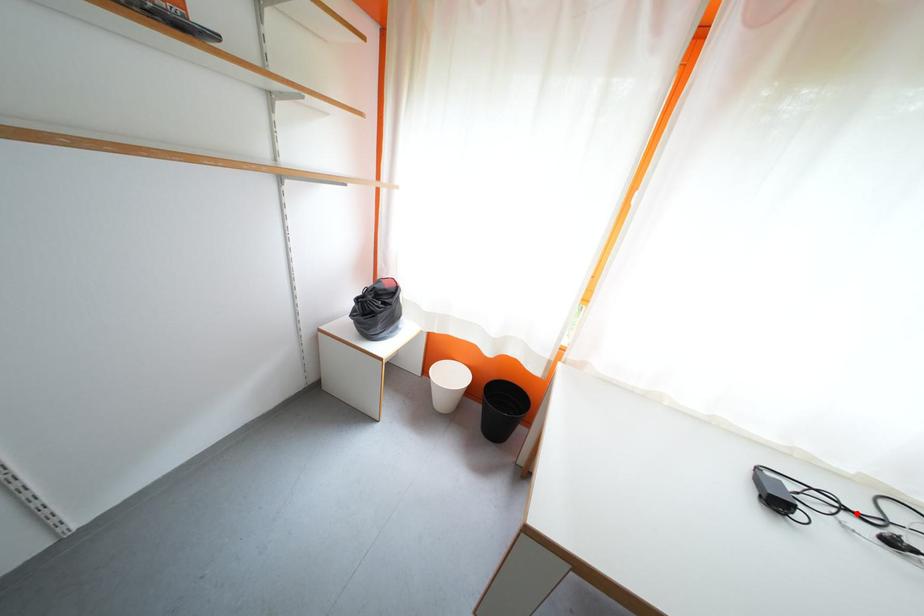
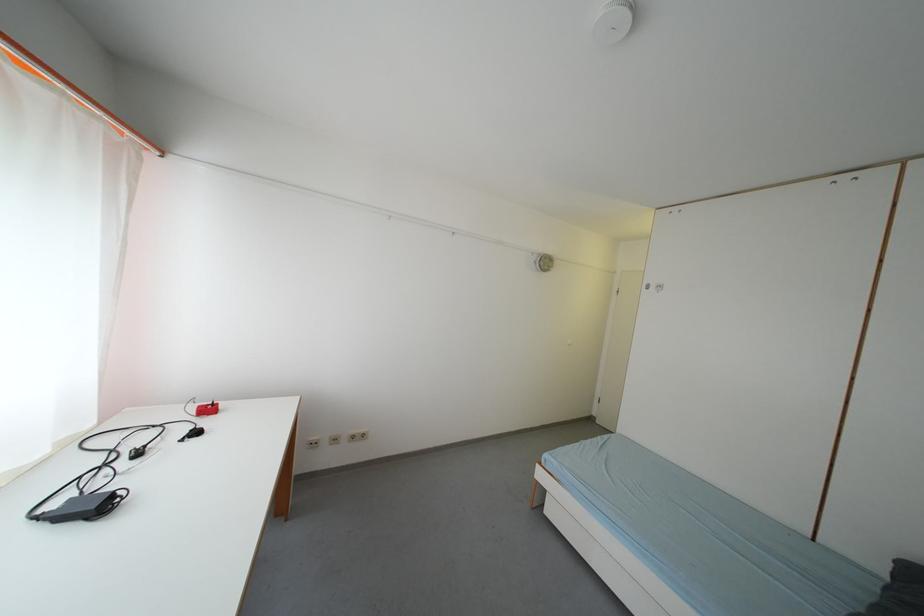
Locate, in the second image, the point that corresponds to the highlighted location in the first image.

(112, 469)